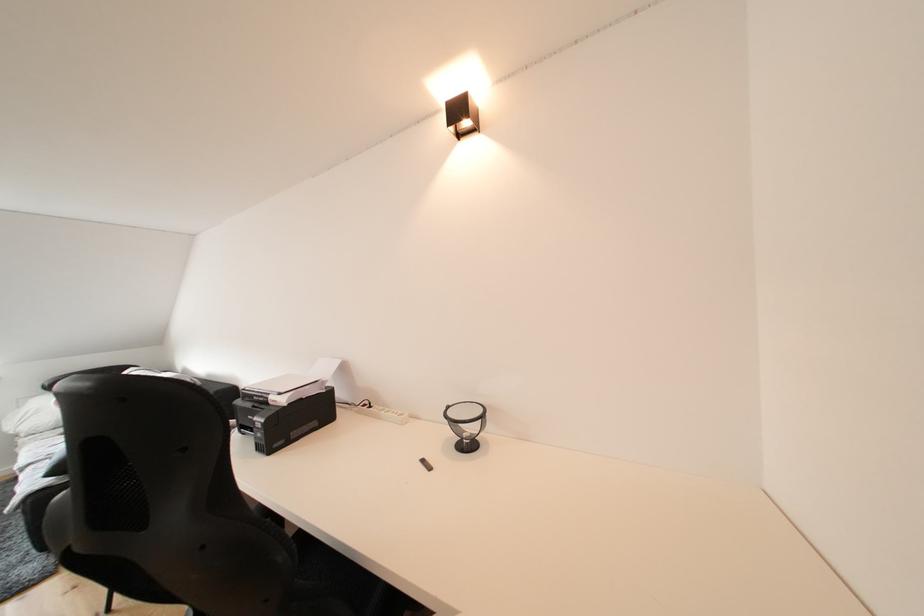
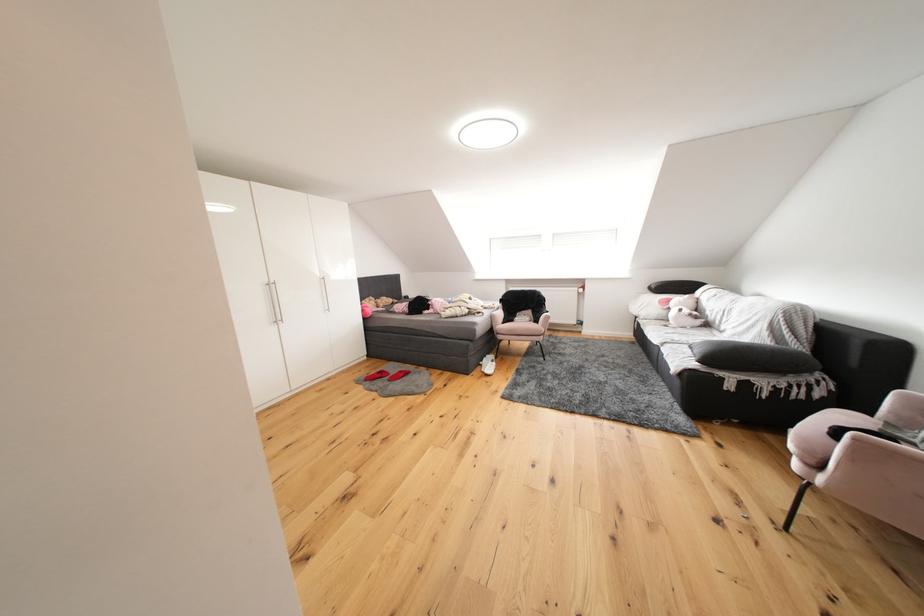
Question: I am providing you with two images of the same scene from different viewpoints. Please identify which objects are invisible in image2.

Choices:
 (A) silver wardrobe handle
 (B) white shoe
 (C) pink chair sitting surface
 (D) none of these

Answer: (D)